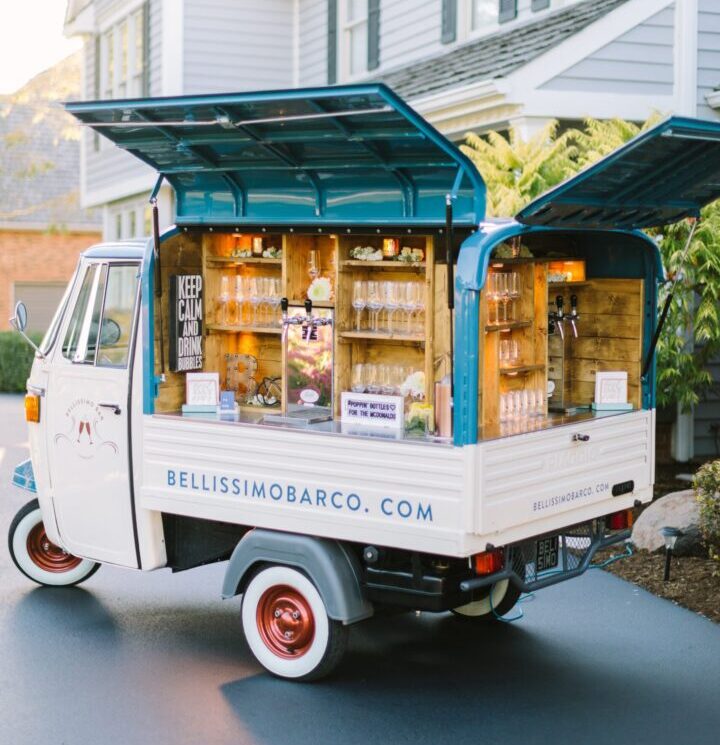
This screenshot has width=720, height=745. Identify the location of window. (99, 329).